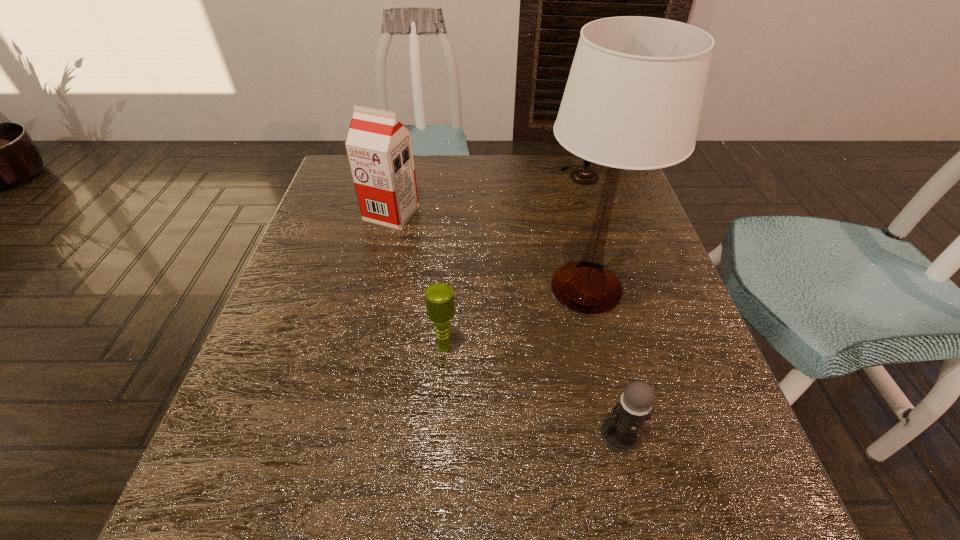
Locate which microphone is the second closest to the soya milk. Please provide its 2D coordinates. Your answer should be formatted as a tuple, i.e. [(x, y)], where the tuple contains the x and y coordinates of a point satisfying the conditions above.

[(584, 176)]